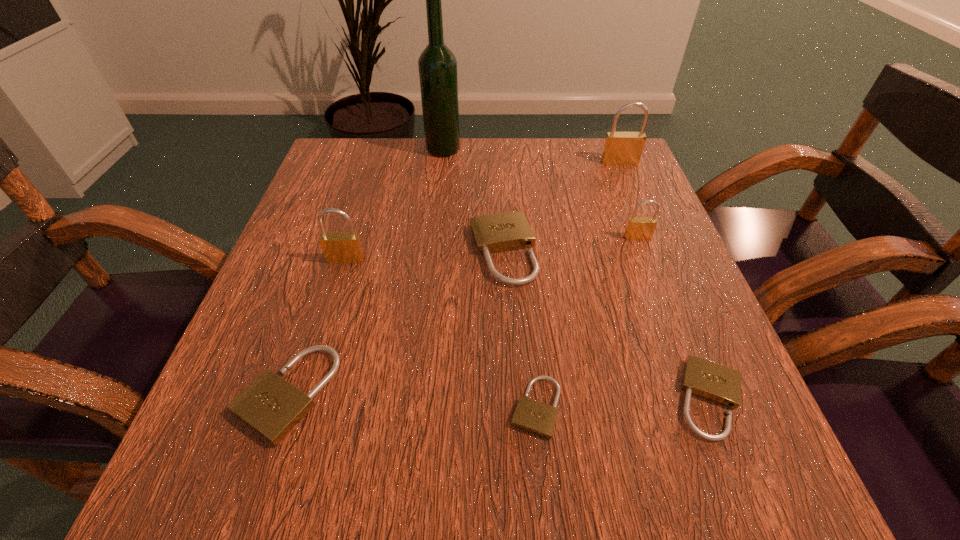
The height and width of the screenshot is (540, 960). Identify the location of the third object from left to right. (437, 65).

Locate an element on the screen. This screenshot has height=540, width=960. the tallest object is located at coordinates (437, 65).

Find the location of a particular element. The image size is (960, 540). the farthest padlock is located at coordinates (621, 148).

Where is `the biggest brass padlock`? The height and width of the screenshot is (540, 960). the biggest brass padlock is located at coordinates (621, 148).

Find the location of `the sixth shortest object`. the sixth shortest object is located at coordinates (338, 247).

At what (x,y) coordinates should I click in order to perform the action: click on the second tallest padlock. Please return your answer as a coordinate pair (x, y). Looking at the image, I should click on (338, 247).

Locate an element on the screen. The height and width of the screenshot is (540, 960). the third tallest padlock is located at coordinates (638, 228).

Locate an element on the screen. the smallest brass padlock is located at coordinates (638, 228).

The image size is (960, 540). Find the location of `the biggest beige padlock`. the biggest beige padlock is located at coordinates (500, 232).

The height and width of the screenshot is (540, 960). I want to click on the fifth tallest object, so click(500, 232).